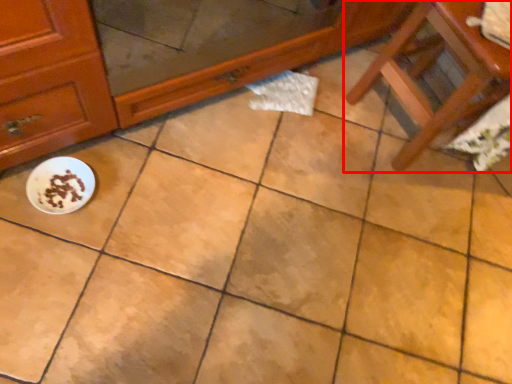
Question: From the image's perspective, considering the relative positions of furniture (annotated by the red box) and meal in the image provided, where is furniture (annotated by the red box) located with respect to the staircase?

Choices:
 (A) below
 (B) above

Answer: (B)